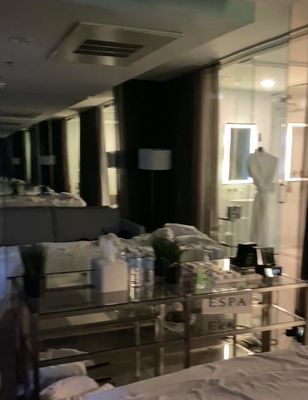
The width and height of the screenshot is (308, 400). Find the location of `tables`. tables is located at coordinates (89, 299), (200, 289).